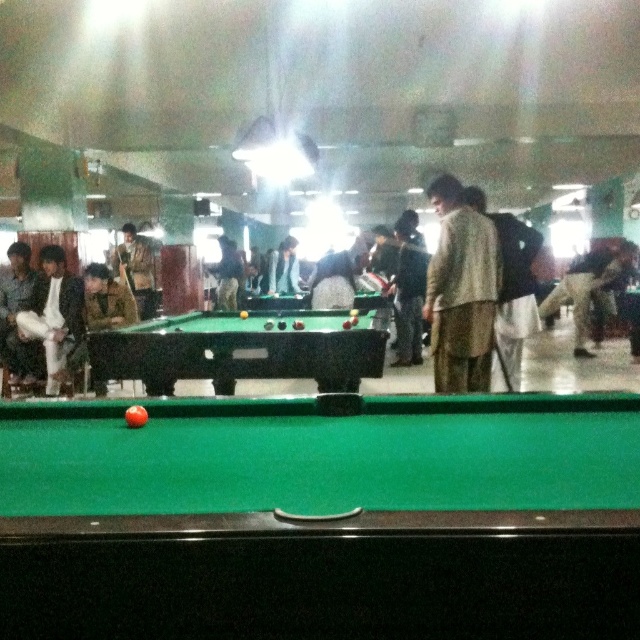
You are a photographer standing at the back of the room. You want to take a photo of both the white cotton pants at left and the camouflage jacket at center in the same frame. The camera you are using has a maximum focus range of 3 meters. Will both subjects be in focus?

The white cotton pants at left and camouflage jacket at center are 3.05 meters apart from each other. Since the camera can only focus up to 3 meters, the distance between them exceeds the focus range. Therefore, both subjects cannot be in focus simultaneously.

You are a photographer trying to capture a candid shot of the white cotton pants at left and the camouflage jacket at center. Since you want to ensure both subjects are in focus, you need to know their heights. Which one is shorter?

The white cotton pants at left is shorter than the camouflage jacket at center because it is not as tall as the camouflage jacket at center.

You are a person who wants to walk from the light beige fabric jacket at center to the light gray fabric jacket at center in the image. How many steps would you need to take if each of your steps is 3 feet long?

The distance between the light beige fabric jacket at center and the light gray fabric jacket at center is 19.28 feet. If each step is 3 feet long, you would need approximately 7 steps to cover the distance.